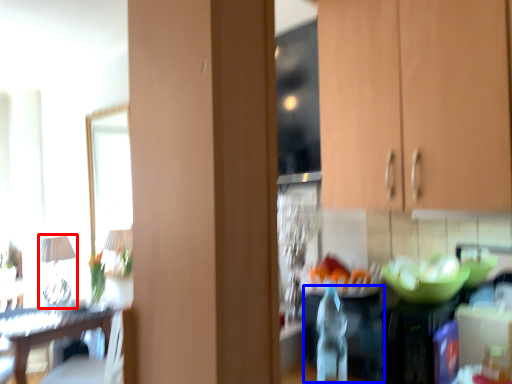
Question: Which object is further to the camera taking this photo, lamp (highlighted by a red box) or appliance (highlighted by a blue box)?

Choices:
 (A) lamp
 (B) appliance

Answer: (A)